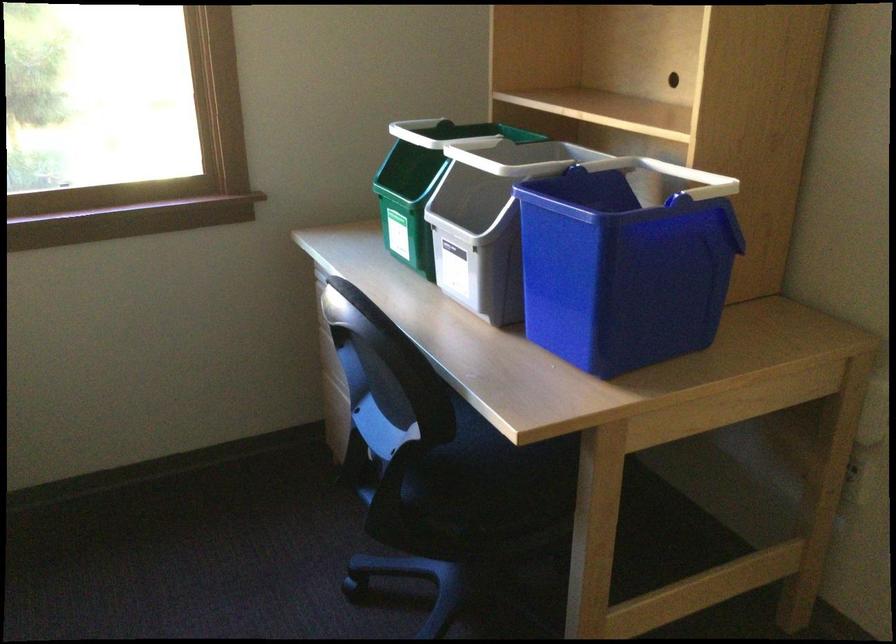
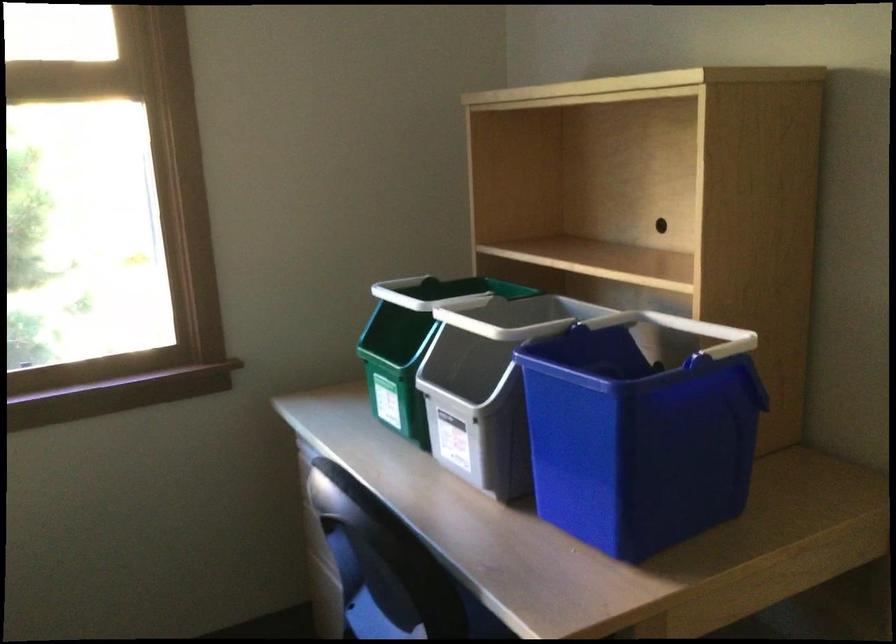
Question: How did the camera likely rotate?

Choices:
 (A) Left
 (B) Right
 (C) Up
 (D) Down

Answer: (C)